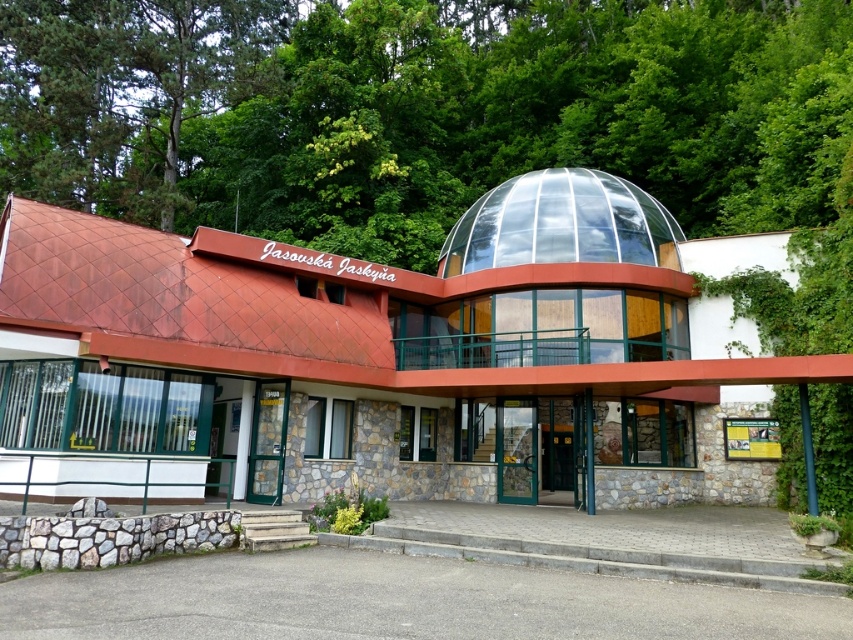
Is point (610, 237) behind point (541, 448)?

No, (610, 237) is closer to viewer.

Which is above, transparent glass dome at center or green glass door at center?

transparent glass dome at center is above.

Measure the distance between transparent glass dome at center and camera.

The distance of transparent glass dome at center from camera is 49.54 feet.

Find the location of `transparent glass dome at center`. transparent glass dome at center is located at coordinates (561, 224).

Between green leafy tree at upper center and transparent glass dome at center, which one has more height?

green leafy tree at upper center

Measure the distance between green leafy tree at upper center and camera.

The distance of green leafy tree at upper center from camera is 15.19 meters.

Find the location of a particular element. green leafy tree at upper center is located at coordinates (444, 116).

Is green leafy tree at upper center to the left of green glass door at center from the viewer's perspective?

Yes, green leafy tree at upper center is to the left of green glass door at center.

Who is taller, green leafy tree at upper center or green glass door at center?

green leafy tree at upper center

Between point (766, 64) and point (573, 435), which one is positioned in front?

Positioned in front is point (573, 435).

Locate an element on the screen. This screenshot has height=640, width=853. green leafy tree at upper center is located at coordinates (444, 116).